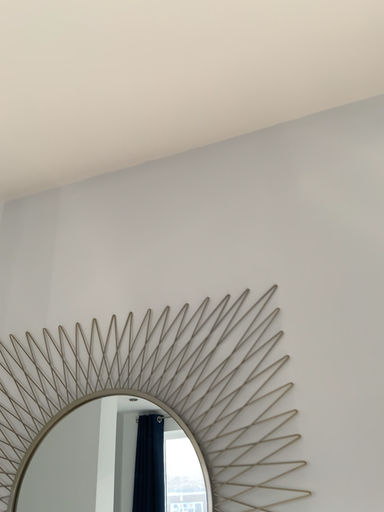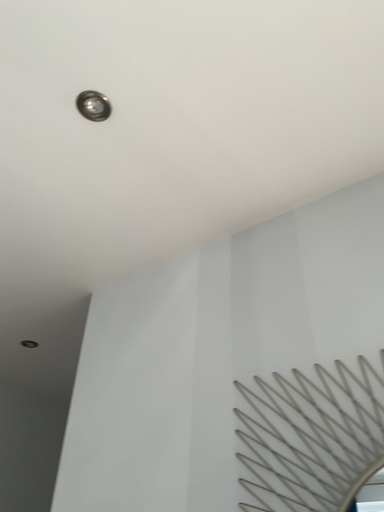
Question: Which way did the camera rotate in the video?

Choices:
 (A) rotated left
 (B) rotated right

Answer: (A)